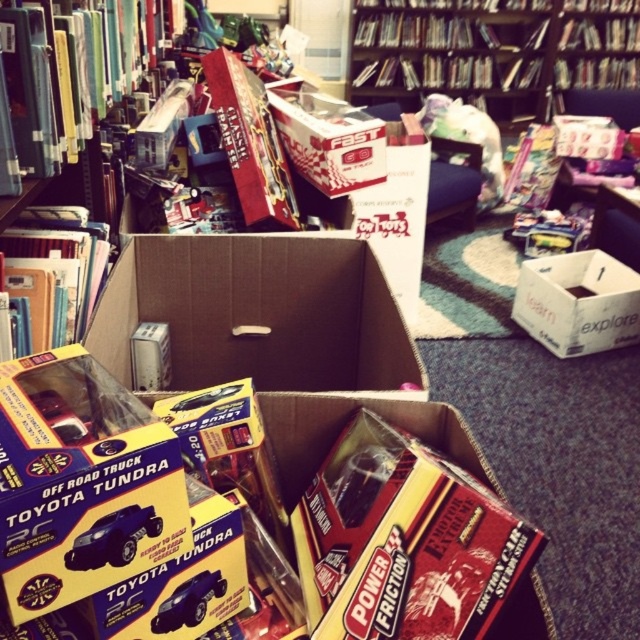
Question: Is wooden bookshelf at upper center positioned before metallic blue toy truck at center?

Choices:
 (A) yes
 (B) no

Answer: (B)

Question: Is wooden bookshelf at upper center positioned behind hardcover book at center?

Choices:
 (A) no
 (B) yes

Answer: (B)

Question: Which point appears closest to the camera in this image?

Choices:
 (A) (131, 70)
 (B) (45, 250)
 (C) (536, 244)
 (D) (556, 266)

Answer: (B)

Question: Does metallic blue car at center have a larger size compared to metallic blue toy truck at center?

Choices:
 (A) yes
 (B) no

Answer: (A)

Question: Which point appears closest to the camera in this image?

Choices:
 (A) (17, 19)
 (B) (19, 397)
 (C) (560, 241)

Answer: (B)

Question: Which is nearer to the white cardboard box at center?

Choices:
 (A) matte yellow toy truck at center
 (B) wooden bookshelf at upper center
 (C) metallic blue car at center
 (D) metallic blue toy truck at center

Answer: (A)